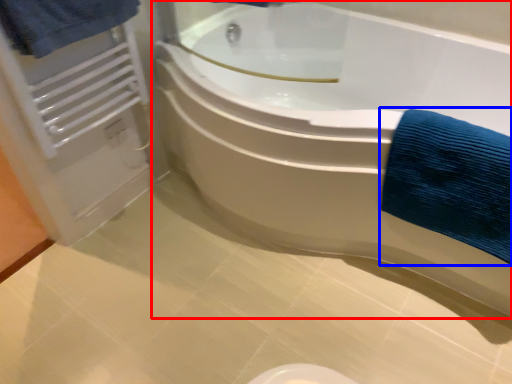
Question: Which object appears closest to the camera in this image, bathtub (highlighted by a red box) or bath towel (highlighted by a blue box)?

Choices:
 (A) bathtub
 (B) bath towel

Answer: (A)